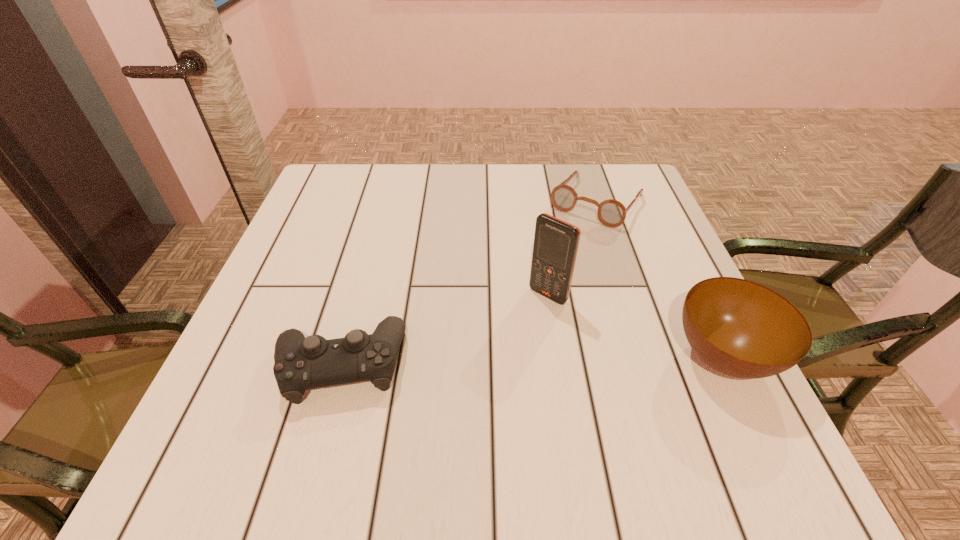
Identify the location of the leftmost object. Image resolution: width=960 pixels, height=540 pixels. (301, 363).

Identify the location of the second shortest object. (301, 363).

At what (x,y) coordinates should I click in order to perform the action: click on the third shortest object. Please return your answer as a coordinate pair (x, y). This screenshot has width=960, height=540. Looking at the image, I should click on (740, 328).

Find the location of a particular element. This screenshot has height=540, width=960. the shortest object is located at coordinates (611, 213).

Locate an element on the screen. The width and height of the screenshot is (960, 540). spectacles is located at coordinates (611, 213).

The width and height of the screenshot is (960, 540). I want to click on cellular telephone, so click(x=556, y=242).

Locate an element on the screen. The width and height of the screenshot is (960, 540). the tallest object is located at coordinates (556, 242).

You are a GUI agent. You are given a task and a screenshot of the screen. Output one action in this format:
    pyautogui.click(x=<x>, y=<y>)
    Task: Click on the vacant space located on the back of the control
    The image size is (960, 540).
    Given the screenshot: What is the action you would take?
    pyautogui.click(x=382, y=207)

This screenshot has height=540, width=960. I want to click on vacant region located 0.370m on the left of the third shortest object, so tap(464, 356).

Identify the location of blank space located on the front-facing side of the shortest object. The image size is (960, 540). (543, 273).